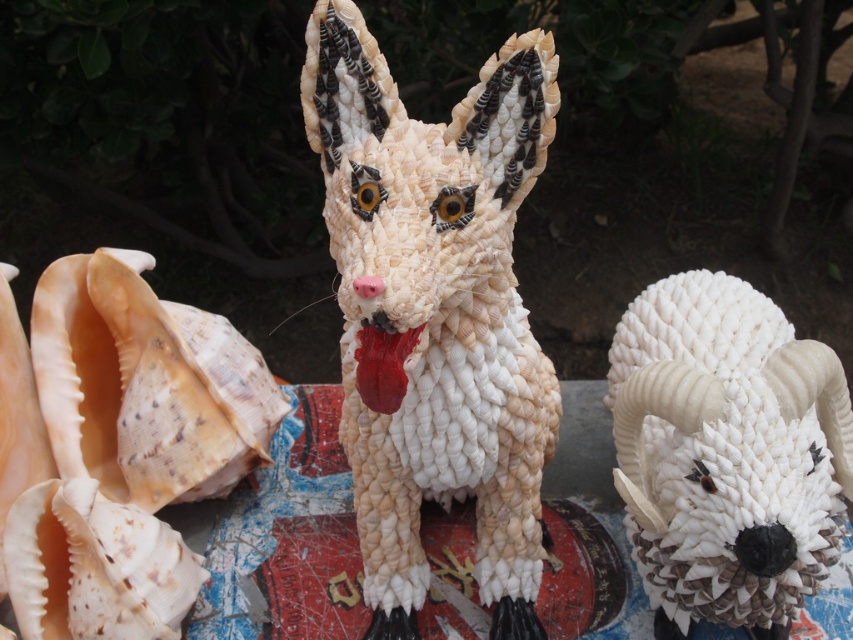
Between white shell figurine at center and white rope-like goat at center, which one has less height?

With less height is white rope-like goat at center.

Identify the location of white shell figurine at center. The height and width of the screenshot is (640, 853). (434, 312).

This screenshot has width=853, height=640. What are the coordinates of `white shell figurine at center` in the screenshot? It's located at pos(434,312).

Is the position of natural seashell conch at left less distant than that of white rope-like goat at center?

That is False.

Who is more forward, (x=149, y=444) or (x=653, y=460)?

Point (x=653, y=460) is in front.

The height and width of the screenshot is (640, 853). Describe the element at coordinates (115, 445) in the screenshot. I see `natural seashell conch at left` at that location.

Image resolution: width=853 pixels, height=640 pixels. I want to click on natural seashell conch at left, so click(115, 445).

Is white shell figurine at center below natural seashell conch at left?

No, white shell figurine at center is not below natural seashell conch at left.

The height and width of the screenshot is (640, 853). What do you see at coordinates (434, 312) in the screenshot? I see `white shell figurine at center` at bounding box center [434, 312].

You are a GUI agent. You are given a task and a screenshot of the screen. Output one action in this format:
    pyautogui.click(x=<x>, y=<y>)
    Task: Click on the white shell figurine at center
    This screenshot has width=853, height=640.
    Given the screenshot: What is the action you would take?
    pyautogui.click(x=434, y=312)